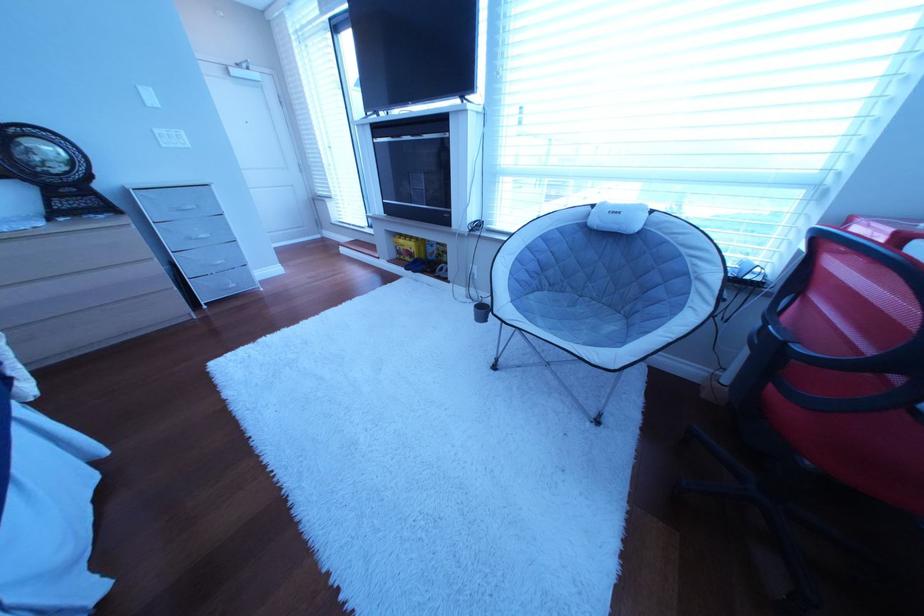
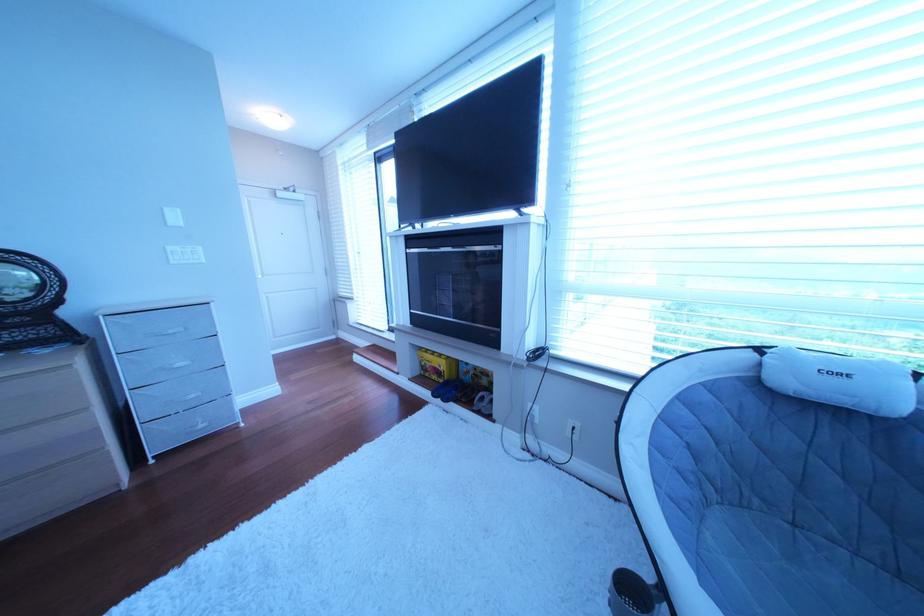
Locate, in the second image, the point that corresponds to (423,261) in the first image.

(450, 379)